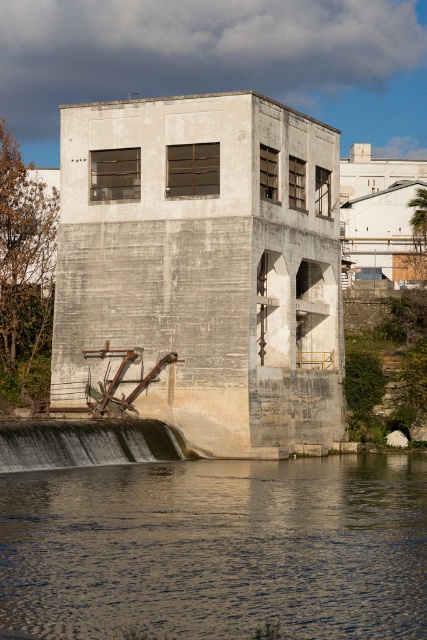
Is clear water at lower center closer to the viewer compared to gray concrete dam at lower left?

Yes.

In the scene shown: Is clear water at lower center to the right of gray concrete dam at lower left from the viewer's perspective?

Correct, you'll find clear water at lower center to the right of gray concrete dam at lower left.

You are a GUI agent. You are given a task and a screenshot of the screen. Output one action in this format:
    pyautogui.click(x=<x>, y=<y>)
    Task: Click on the clear water at lower center
    
    Given the screenshot: What is the action you would take?
    pyautogui.click(x=218, y=548)